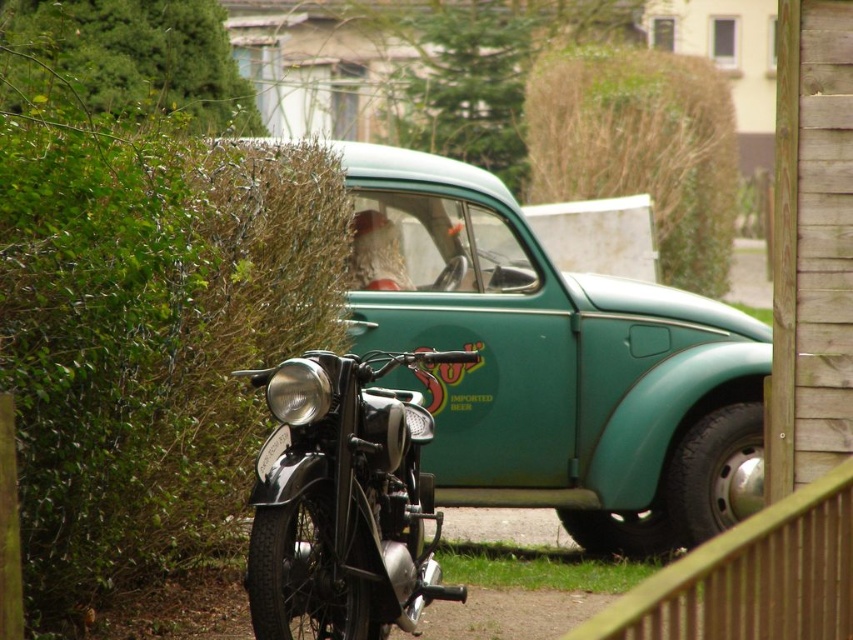
Question: Which is nearer to the green leafy hedge at upper left?

Choices:
 (A) teal matte car at center
 (B) shiny black motorcycle at center
 (C) brown textured hedge at upper center
 (D) metallic silver at front

Answer: (A)

Question: Is teal matte car at center bigger than green leafy hedge at upper left?

Choices:
 (A) yes
 (B) no

Answer: (A)

Question: Observing the image, what is the correct spatial positioning of brown textured hedge at upper center in reference to green leafy hedge at upper left?

Choices:
 (A) right
 (B) left

Answer: (A)

Question: Which point is farther to the camera?

Choices:
 (A) green leafy hedge at upper left
 (B) brown textured hedge at upper center
 (C) shiny black motorcycle at center

Answer: (B)

Question: Where is teal matte car at center located in relation to metallic silver at front in the image?

Choices:
 (A) left
 (B) right

Answer: (B)

Question: Which point is farther from the camera taking this photo?

Choices:
 (A) (265, 472)
 (B) (698, 200)
 (C) (326, 570)
 (D) (74, 22)

Answer: (B)